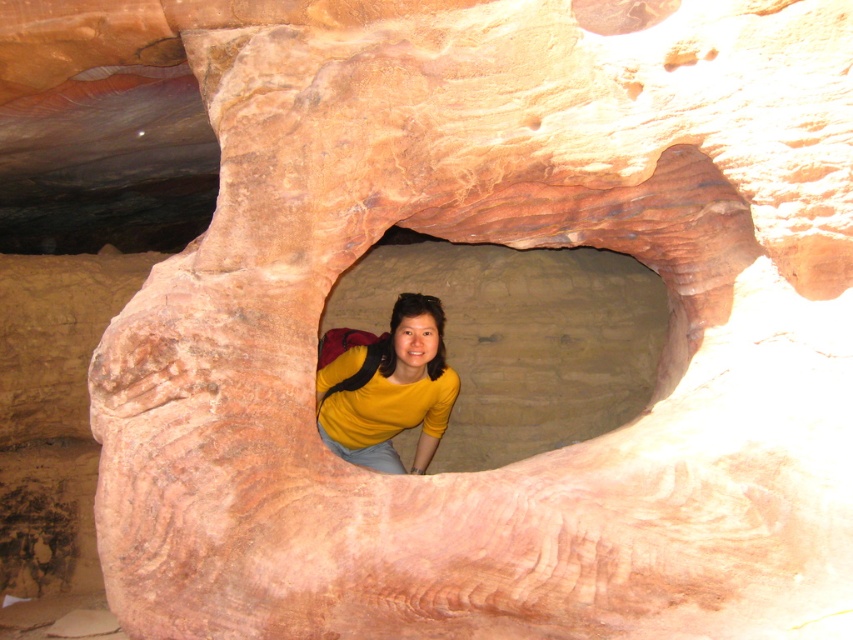
Does matte yellow shirt at center appear on the right side of yellow matte shirt at center?

Indeed, matte yellow shirt at center is positioned on the right side of yellow matte shirt at center.

Consider the image. Can you confirm if matte yellow shirt at center is positioned below yellow matte shirt at center?

Incorrect, matte yellow shirt at center is not positioned below yellow matte shirt at center.

Is point (473, 385) in front of point (354, 396)?

No.

Locate an element on the screen. matte yellow shirt at center is located at coordinates (521, 339).